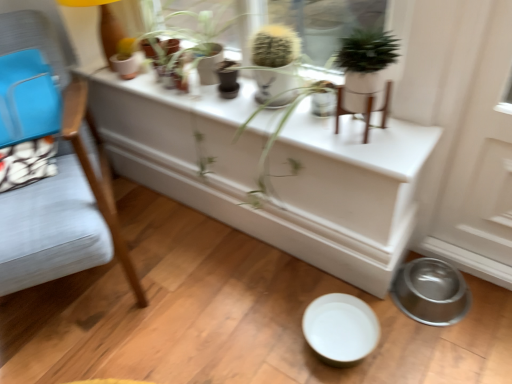
At what (x,y) coordinates should I click in order to perform the action: click on vacant space underneath metallic silver bowl at lower right (from a real-world perspective). Please return your answer as a coordinate pair (x, y). Looking at the image, I should click on (431, 288).